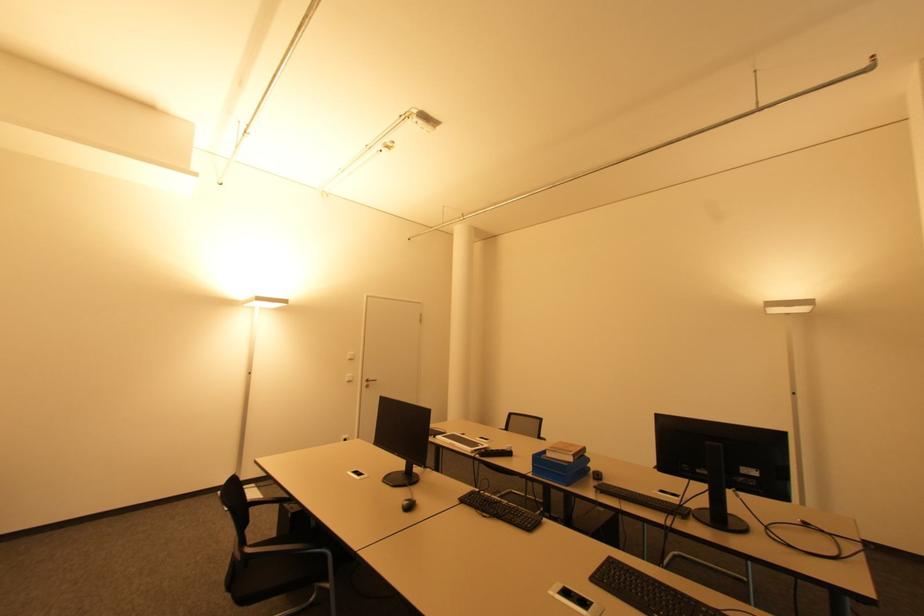
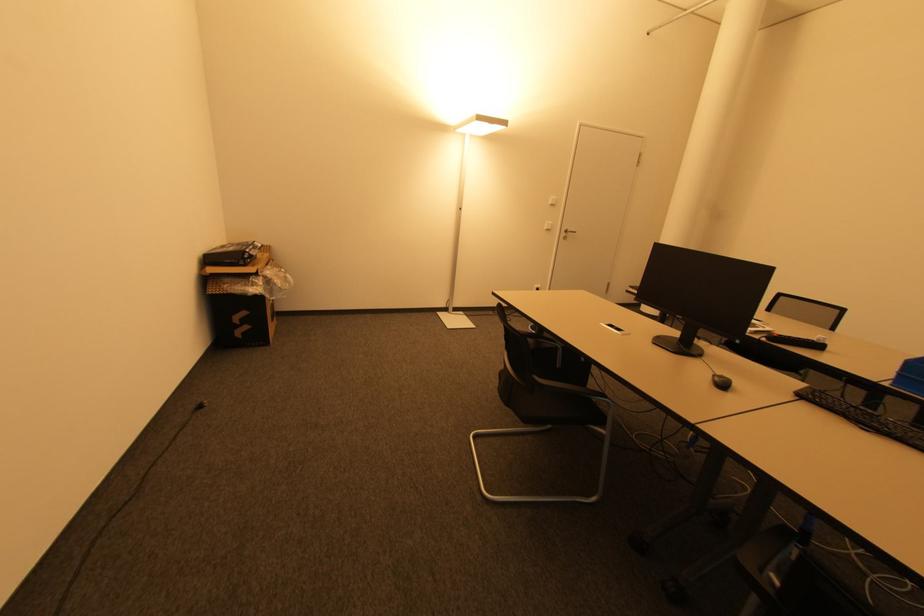
Based on the continuous images, in which direction is the camera rotating?

The camera rotated toward left-down.